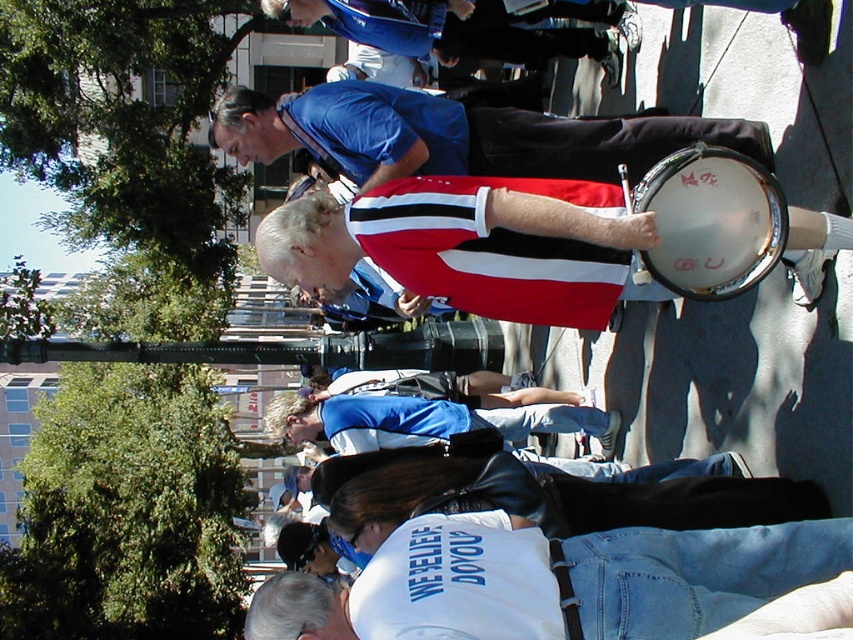
Between white matte shirt at lower center and white matte drum at center, which one is positioned lower?

white matte shirt at lower center is below.

Looking at this image, which of these two, white matte shirt at lower center or white matte drum at center, stands shorter?

white matte shirt at lower center

Locate an element on the screen. Image resolution: width=853 pixels, height=640 pixels. white matte shirt at lower center is located at coordinates (552, 580).

You are a GUI agent. You are given a task and a screenshot of the screen. Output one action in this format:
    pyautogui.click(x=<x>, y=<y>)
    Task: Click on the white matte shirt at lower center
    Image resolution: width=853 pixels, height=640 pixels.
    Given the screenshot: What is the action you would take?
    pyautogui.click(x=552, y=580)

In order to click on white matte shirt at lower center in this screenshot , I will do `click(552, 580)`.

The height and width of the screenshot is (640, 853). What are the coordinates of `white matte shirt at lower center` in the screenshot? It's located at (552, 580).

Which is behind, point (465, 218) or point (653, 272)?

Positioned behind is point (465, 218).

Identify the location of white matte drum at center. The height and width of the screenshot is (640, 853). (474, 244).